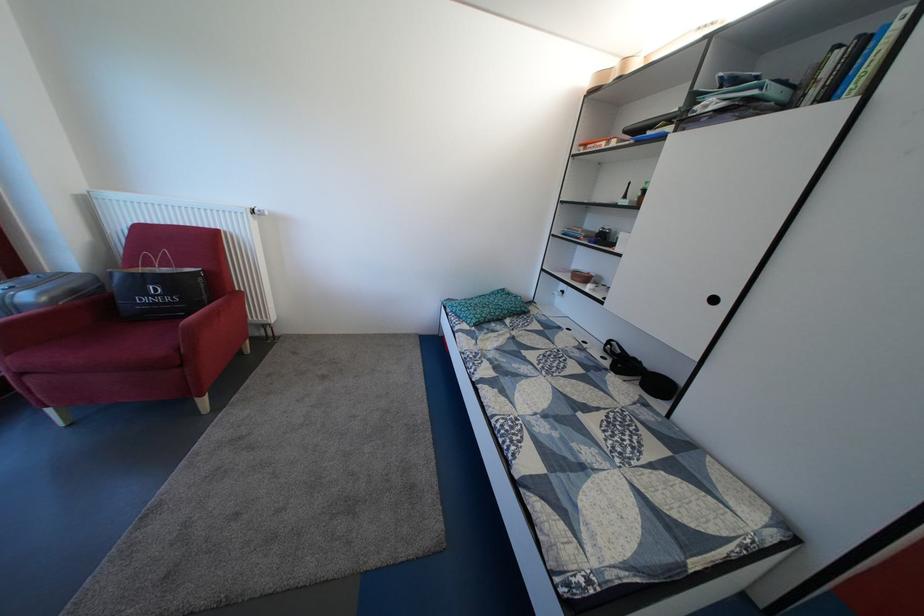
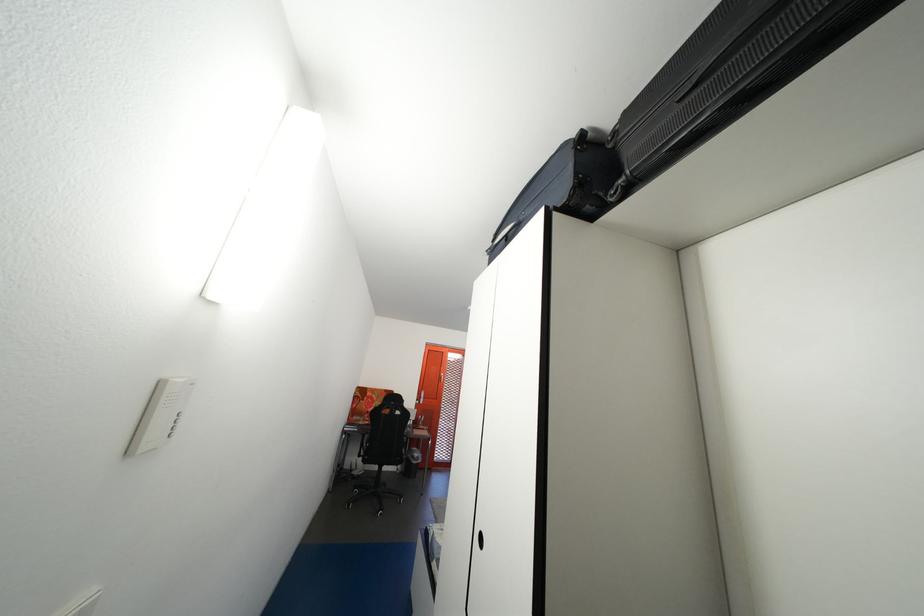
Question: I am providing you with two images of the same scene from different viewpoints. After the viewpoint changes to image2, which objects are now occluded?

Choices:
 (A) black chair armrest
 (B) black paper bag
 (C) red alarm clock
 (D) orange door handle

Answer: (B)